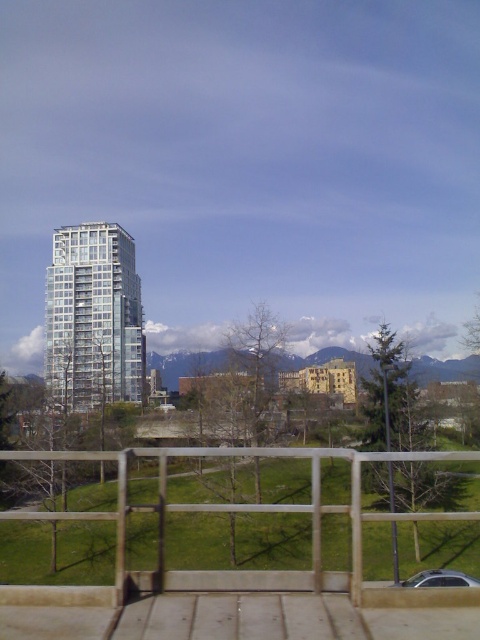
Who is positioned more to the left, wooden at lower center or clear glass building at center?

Positioned to the left is clear glass building at center.

You are a GUI agent. You are given a task and a screenshot of the screen. Output one action in this format:
    pyautogui.click(x=<x>, y=<y>)
    Task: Click on the wooden at lower center
    The height and width of the screenshot is (640, 480).
    Given the screenshot: What is the action you would take?
    pyautogui.click(x=224, y=570)

Is point (233, 605) less distant than point (75, 236)?

That is True.

At what (x,y) coordinates should I click in order to perform the action: click on wooden at lower center. Please return your answer as a coordinate pair (x, y). The height and width of the screenshot is (640, 480). Looking at the image, I should click on (224, 570).